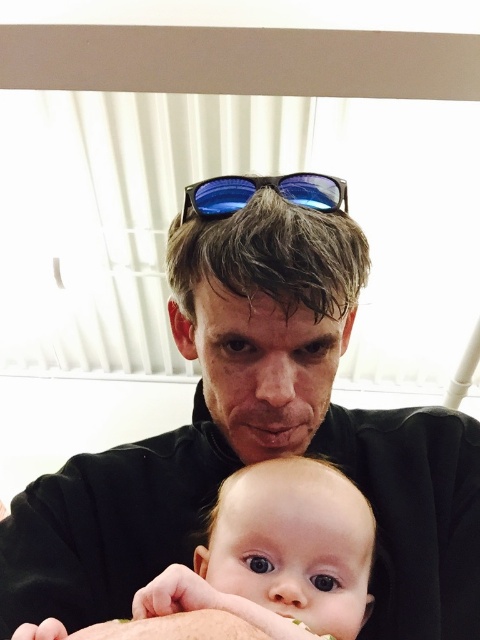
Is point (47, 556) positioned in front of point (313, 179)?

No, (47, 556) is behind (313, 179).

The height and width of the screenshot is (640, 480). In order to click on black matte shirt at center in this screenshot , I will do `click(256, 440)`.

From the picture: Who is taller, smooth skin baby at center or blue reflective lenses at center?

Standing taller between the two is smooth skin baby at center.

Is point (182, 608) less distant than point (319, 184)?

Yes, it is.

The width and height of the screenshot is (480, 640). Describe the element at coordinates (278, 554) in the screenshot. I see `smooth skin baby at center` at that location.

Find the location of a particular element. The image size is (480, 640). smooth skin baby at center is located at coordinates (278, 554).

Between black matte shirt at center and smooth skin baby at center, which one appears on the right side from the viewer's perspective?

Positioned to the right is black matte shirt at center.

Describe the element at coordinates (256, 440) in the screenshot. I see `black matte shirt at center` at that location.

The height and width of the screenshot is (640, 480). Find the location of `black matte shirt at center`. black matte shirt at center is located at coordinates (256, 440).